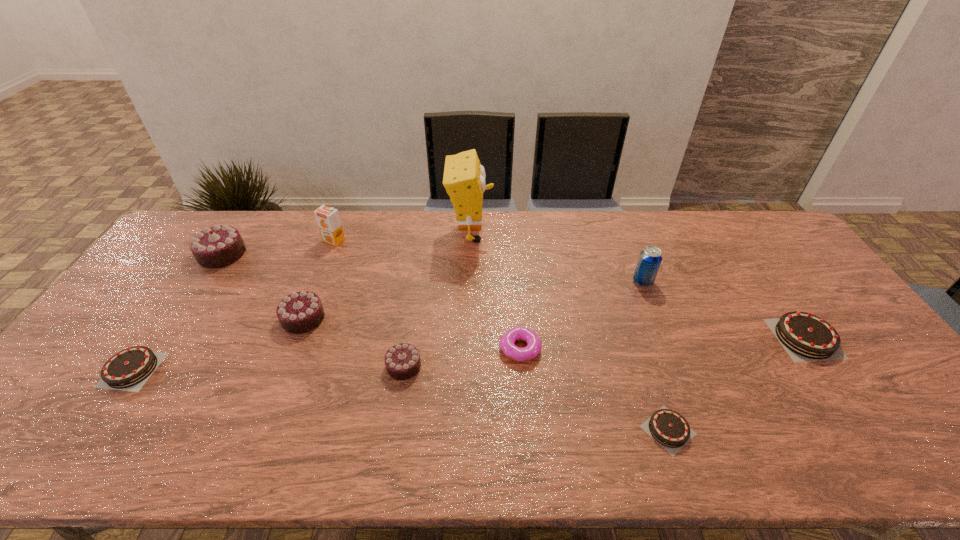
Find the location of a particular element. This screenshot has width=960, height=540. the smallest chocolate chocolate cake is located at coordinates pyautogui.click(x=402, y=361).

Where is `the rightmost chocolate cake`? the rightmost chocolate cake is located at coordinates click(805, 337).

Where is `the rightmost brown chocolate cake`? the rightmost brown chocolate cake is located at coordinates (805, 337).

Identify the location of the second smallest brown chocolate cake. (128, 370).

Identify the location of the leftmost brown chocolate cake. The height and width of the screenshot is (540, 960). (128, 370).

Where is `the fourth object from right to left`? This screenshot has width=960, height=540. the fourth object from right to left is located at coordinates (507, 340).

Identify the location of pink doughnut. (507, 340).

You are a GUI agent. You are given a task and a screenshot of the screen. Output one action in this format:
    pyautogui.click(x=<x>, y=<y>)
    Task: Click on the second brown chocolate cake from right to left
    Image resolution: width=960 pixels, height=540 pixels.
    Given the screenshot: What is the action you would take?
    pyautogui.click(x=668, y=428)

This screenshot has width=960, height=540. Find the location of `the nearest brown chocolate cake`. the nearest brown chocolate cake is located at coordinates [668, 428].

Image resolution: width=960 pixels, height=540 pixels. I want to click on vacant point located on the face of the sixth object from left to right, so click(589, 233).